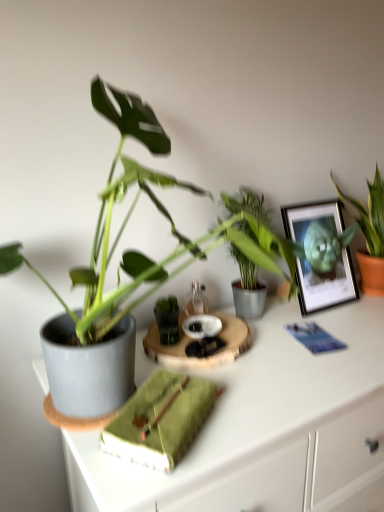
Identify the location of vacant area that is in front of green leafy plant at upper right, the 2th houseplant in the front-to-back sequence. This screenshot has width=384, height=512. (357, 313).